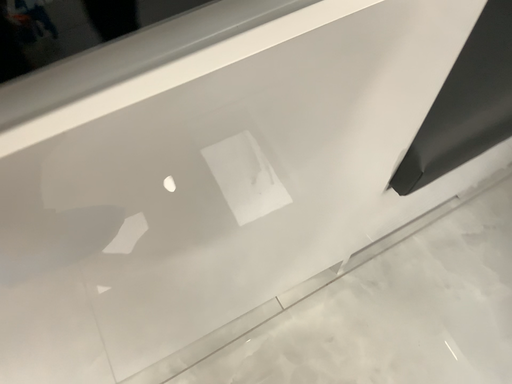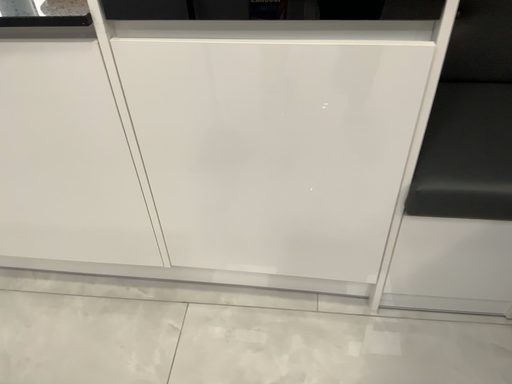
Question: How did the camera likely rotate when shooting the video?

Choices:
 (A) rotated upward
 (B) rotated downward

Answer: (A)